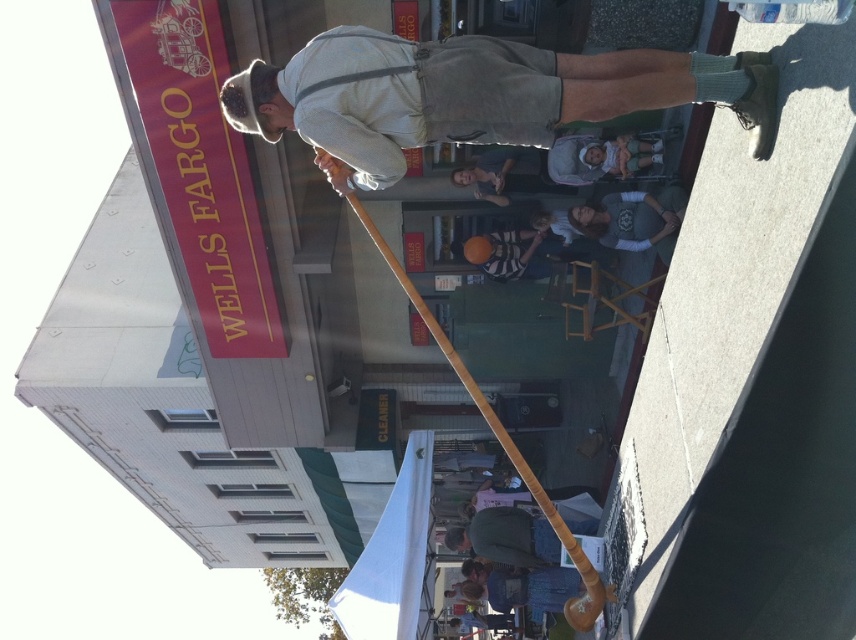
Question: Can you confirm if light brown wooden cane at center is positioned above striped cotton shirt at center?

Choices:
 (A) yes
 (B) no

Answer: (B)

Question: Among these points, which one is nearest to the camera?

Choices:
 (A) (366, 228)
 (B) (426, 125)
 (C) (649, 196)

Answer: (B)

Question: Which point is farther to the camera?

Choices:
 (A) tap(349, 54)
 (B) tap(502, 432)
 (C) tap(646, 212)
 (D) tap(500, 273)

Answer: (D)

Question: Can you confirm if wooden pole at center is positioned below gray cotton shirt at center?

Choices:
 (A) yes
 (B) no

Answer: (A)

Question: Which object appears closest to the camera in this image?

Choices:
 (A) light brown wooden cane at center
 (B) gray cotton shirt at center

Answer: (A)

Question: Does gray cotton shirt at center appear on the right side of striped cotton shirt at center?

Choices:
 (A) no
 (B) yes

Answer: (B)